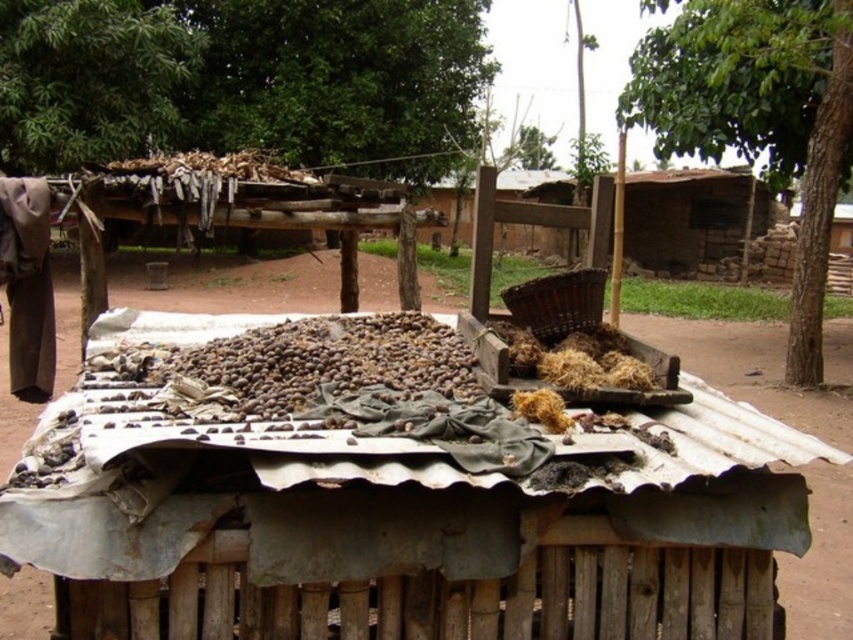
Question: Is brown matte nuts at center further to the viewer compared to brown straw at center?

Choices:
 (A) no
 (B) yes

Answer: (A)

Question: Which point is closer to the camera?

Choices:
 (A) brown woven basket at center
 (B) brown straw at center

Answer: (B)

Question: Can you confirm if brown dirt field at center is positioned above brown straw at center?

Choices:
 (A) no
 (B) yes

Answer: (B)

Question: Among these points, which one is nearest to the camera?

Choices:
 (A) (270, 294)
 (B) (376, 392)
 (C) (593, 278)

Answer: (B)

Question: Is brown dirt field at center positioned at the back of brown matte nuts at center?

Choices:
 (A) yes
 (B) no

Answer: (B)

Question: Which point is closer to the camera taking this photo?

Choices:
 (A) (532, 301)
 (B) (155, 372)
 (C) (531, 339)

Answer: (B)